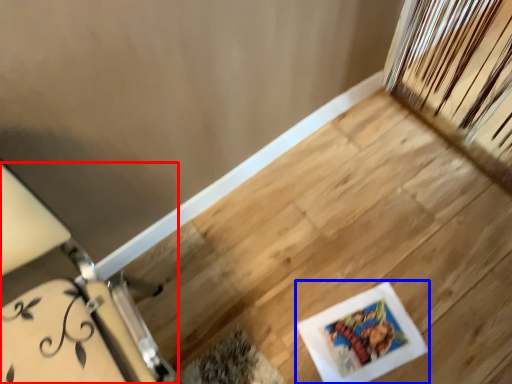
Question: Among these objects, which one is farthest to the camera, furniture (highlighted by a red box) or picture frame (highlighted by a blue box)?

Choices:
 (A) furniture
 (B) picture frame

Answer: (B)